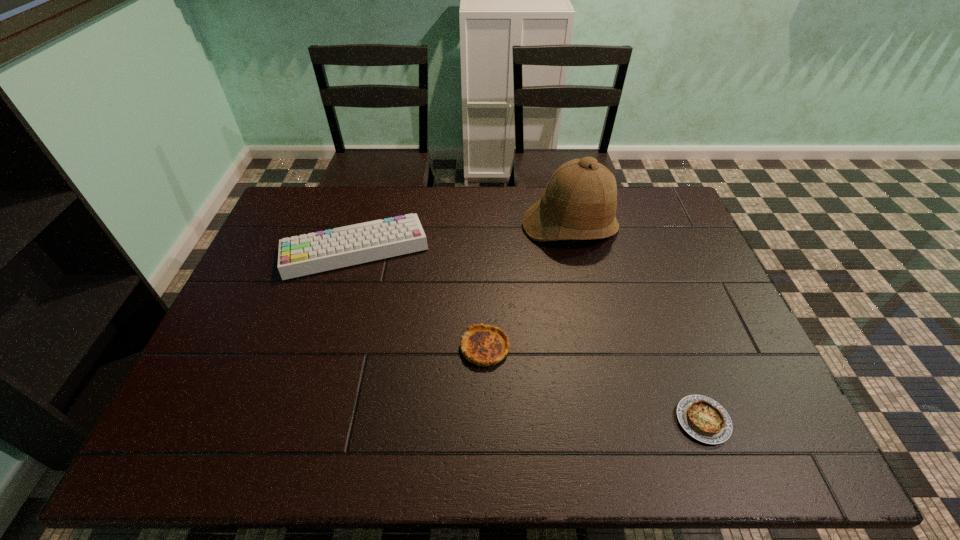
You are a GUI agent. You are given a task and a screenshot of the screen. Output one action in this format:
    pyautogui.click(x=<x>, y=<y>)
    Task: Click on the empty space that is in between the nearest object and the hat
    This screenshot has width=960, height=540.
    Given the screenshot: What is the action you would take?
    pyautogui.click(x=636, y=323)

Locate an element on the screen. free space between the hat and the shorter quiche is located at coordinates (636, 323).

Locate which object ranks in proximity to the farther quiche. Please provide its 2D coordinates. Your answer should be formatted as a tuple, i.e. [(x, y)], where the tuple contains the x and y coordinates of a point satisfying the conditions above.

[(302, 255)]

Choose which object is the third nearest neighbor to the second shortest object. Please provide its 2D coordinates. Your answer should be formatted as a tuple, i.e. [(x, y)], where the tuple contains the x and y coordinates of a point satisfying the conditions above.

[(704, 419)]

Find the location of `free space that satisfies the following two spatial constraints: 1. on the front-facing side of the tallest object; 2. on the left side of the nearest object`. free space that satisfies the following two spatial constraints: 1. on the front-facing side of the tallest object; 2. on the left side of the nearest object is located at coordinates (613, 421).

Find the location of a particular element. This screenshot has width=960, height=540. free region that satisfies the following two spatial constraints: 1. on the front side of the second tallest object; 2. on the left side of the nearest object is located at coordinates (304, 421).